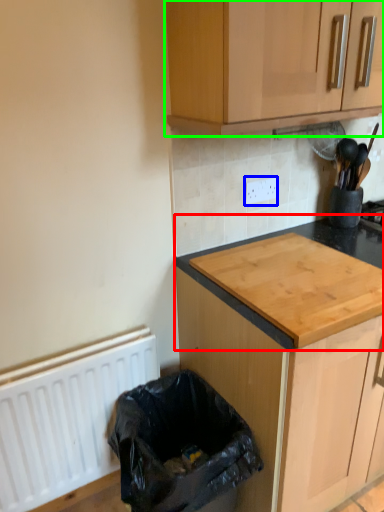
Question: Which is farther away from countertop (highlighted by a red box)? electric outlet (highlighted by a blue box) or cabinetry (highlighted by a green box)?

Choices:
 (A) electric outlet
 (B) cabinetry

Answer: (B)